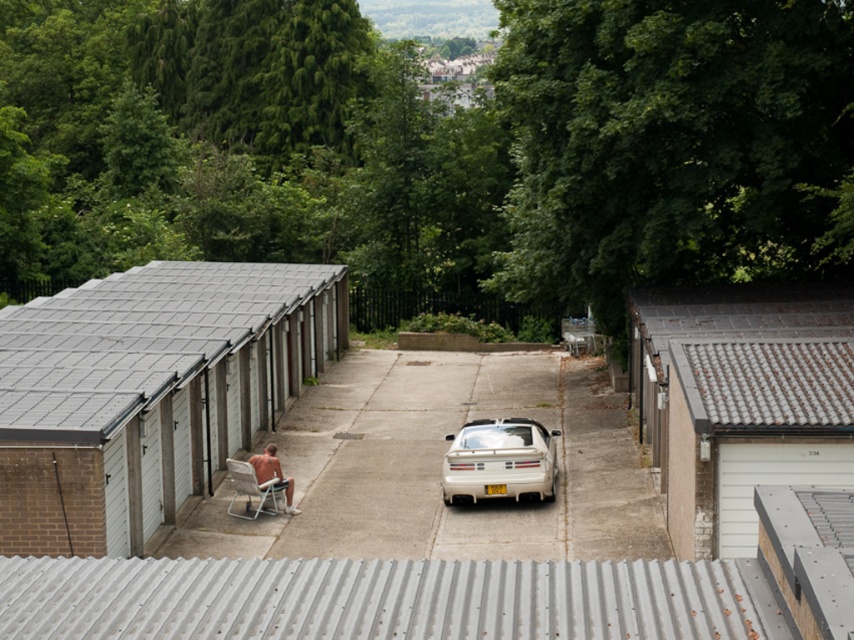
Question: Which point is closer to the camera taking this photo?

Choices:
 (A) (288, 477)
 (B) (22, 419)

Answer: (B)

Question: Does gray tile roof at upper right appear on the right side of white glossy car at center?

Choices:
 (A) no
 (B) yes

Answer: (B)

Question: Which object is the farthest from the nude skin at lower left?

Choices:
 (A) white matte shed at left
 (B) white tile roof at right

Answer: (B)

Question: Where is white matte shed at left located in relation to nude skin at lower left in the image?

Choices:
 (A) below
 (B) above

Answer: (B)

Question: Based on their relative distances, which object is farther from the nude skin at lower left?

Choices:
 (A) white matte shed at left
 (B) white tile roof at right
 (C) gray tile roof at upper right
 (D) white matte car at center

Answer: (C)

Question: Is white glossy car at center closer to the viewer compared to nude skin at lower left?

Choices:
 (A) no
 (B) yes

Answer: (A)